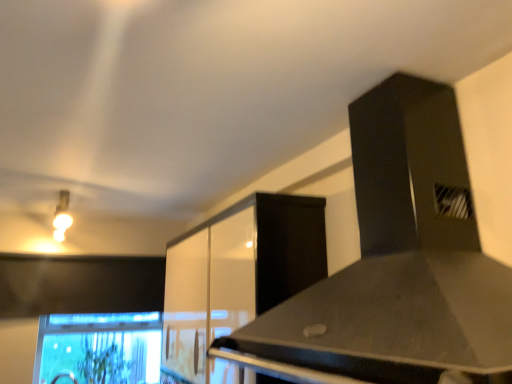
Question: Can you confirm if matte gold light fixture at upper left is taller than black matte vent at upper right?

Choices:
 (A) yes
 (B) no

Answer: (B)

Question: From the image's perspective, is matte gold light fixture at upper left over black matte vent at upper right?

Choices:
 (A) yes
 (B) no

Answer: (B)

Question: Is matte gold light fixture at upper left bigger than black matte vent at upper right?

Choices:
 (A) no
 (B) yes

Answer: (A)

Question: Does matte gold light fixture at upper left have a greater width compared to black matte vent at upper right?

Choices:
 (A) no
 (B) yes

Answer: (B)

Question: Is matte gold light fixture at upper left next to black matte vent at upper right and touching it?

Choices:
 (A) no
 (B) yes

Answer: (A)

Question: Considering the positions of point (67, 382) and point (83, 339), is point (67, 382) closer or farther from the camera than point (83, 339)?

Choices:
 (A) closer
 (B) farther

Answer: (A)

Question: From their relative heights in the image, would you say clear glass monitor at lower left is taller or shorter than green leafy plant at lower left?

Choices:
 (A) short
 (B) tall

Answer: (B)

Question: Relative to green leafy plant at lower left, is clear glass monitor at lower left in front or behind?

Choices:
 (A) front
 (B) behind

Answer: (A)

Question: Is clear glass monitor at lower left situated inside green leafy plant at lower left or outside?

Choices:
 (A) outside
 (B) inside

Answer: (A)

Question: Does point (265, 312) appear closer or farther from the camera than point (158, 324)?

Choices:
 (A) farther
 (B) closer

Answer: (B)

Question: Considering the relative positions of black matte vent at upper right and clear glass monitor at lower left in the image provided, is black matte vent at upper right to the left or to the right of clear glass monitor at lower left?

Choices:
 (A) right
 (B) left

Answer: (A)

Question: From the image's perspective, is black matte vent at upper right above or below clear glass monitor at lower left?

Choices:
 (A) above
 (B) below

Answer: (A)

Question: Is black matte vent at upper right bigger or smaller than clear glass monitor at lower left?

Choices:
 (A) big
 (B) small

Answer: (A)

Question: Which is correct: matte gold light fixture at upper left is inside green leafy plant at lower left, or outside of it?

Choices:
 (A) outside
 (B) inside

Answer: (A)

Question: In the image, is matte gold light fixture at upper left positioned in front of or behind green leafy plant at lower left?

Choices:
 (A) behind
 (B) front

Answer: (B)